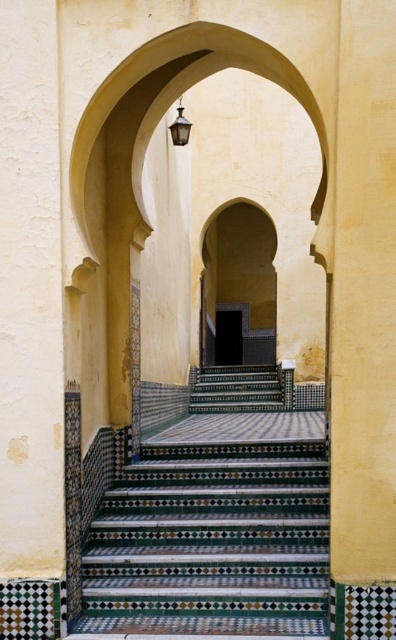
Question: Among these objects, which one is farthest from the camera?

Choices:
 (A) multicolored mosaic stairs at center
 (B) smooth beige arch at center
 (C) matte black lantern at upper center

Answer: (B)

Question: Which point is farther from the camera taking this photo?

Choices:
 (A) (188, 132)
 (B) (276, 380)
 (C) (247, 300)
 (D) (150, 609)

Answer: (C)

Question: Can you confirm if smooth beige arch at center is thinner than multicolored mosaic stairs at center?

Choices:
 (A) no
 (B) yes

Answer: (B)

Question: Which object is the farthest from the multicolored mosaic stairs at center?

Choices:
 (A) mosaic tile stairs at center
 (B) smooth beige arch at center

Answer: (A)

Question: Considering the relative positions of multicolored mosaic stairs at center and matte black lantern at upper center in the image provided, where is multicolored mosaic stairs at center located with respect to matte black lantern at upper center?

Choices:
 (A) below
 (B) above

Answer: (A)

Question: Can you confirm if smooth beige arch at center is bigger than matte black lantern at upper center?

Choices:
 (A) no
 (B) yes

Answer: (B)